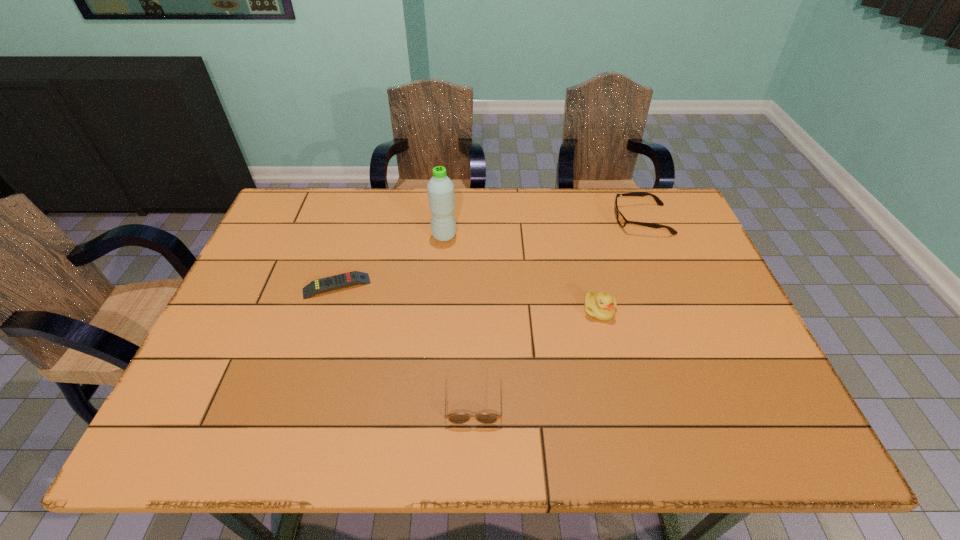
At what (x,y) coordinates should I click in order to perform the action: click on free region at the far edge of the desktop. Please return your answer as a coordinate pair (x, y). Looking at the image, I should click on pos(527,222).

Where is `vacant region at the near edge of the desktop`? This screenshot has width=960, height=540. vacant region at the near edge of the desktop is located at coordinates (401, 434).

You are a GUI agent. You are given a task and a screenshot of the screen. Output one action in this format:
    pyautogui.click(x=<x>, y=<y>)
    Task: Click on the vacant space at the left edge
    This screenshot has height=540, width=960.
    Given the screenshot: What is the action you would take?
    pyautogui.click(x=305, y=248)

Identify the location of vacant point at the right edge. The height and width of the screenshot is (540, 960). (704, 312).

Locate an element on the screen. vacant area at the far left corner is located at coordinates (310, 231).

Locate an element on the screen. vacant space at the far right corner is located at coordinates (652, 232).

Where is `free space between the leftmost object and the second tallest object`? The height and width of the screenshot is (540, 960). free space between the leftmost object and the second tallest object is located at coordinates (468, 298).

Identify the location of free point between the tallest object and the sunglasses. This screenshot has width=960, height=540. (459, 317).

In order to click on free space between the duckling and the rightmost object in this screenshot , I will do `click(620, 265)`.

Identify the location of vacant space that is in between the rightmost object and the duckling. The width and height of the screenshot is (960, 540). (620, 265).